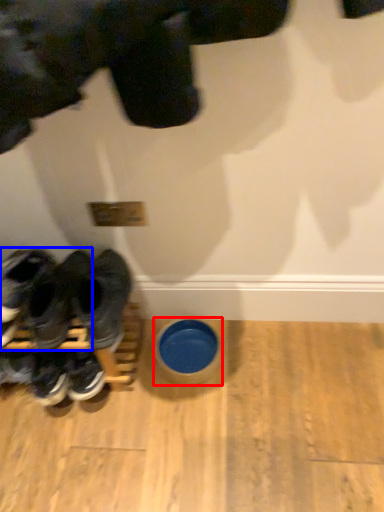
Question: Which object is closer to the camera taking this photo, bowl (highlighted by a red box) or footwear (highlighted by a blue box)?

Choices:
 (A) bowl
 (B) footwear

Answer: (B)